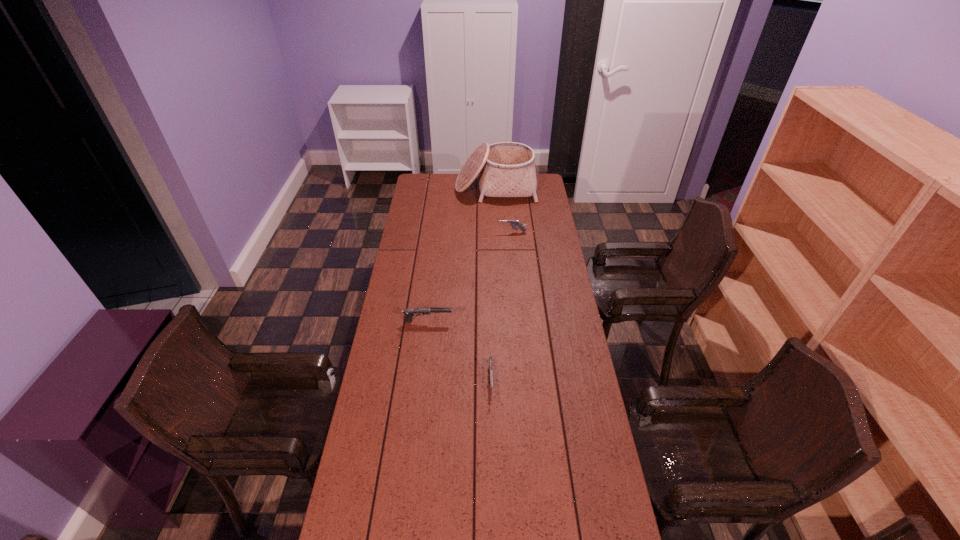
Locate an element on the screen. vacant space at the right edge is located at coordinates (536, 204).

The height and width of the screenshot is (540, 960). Identify the location of vacant space at the far right corner. (539, 181).

You are a GUI agent. You are given a task and a screenshot of the screen. Output one action in this format:
    pyautogui.click(x=<x>, y=<y>)
    Task: Click on the free space between the basket and the second nearest object
    This screenshot has height=540, width=960.
    Given the screenshot: What is the action you would take?
    pyautogui.click(x=462, y=254)

Identify the location of vacant space in between the basket and the farthest gun. This screenshot has width=960, height=540. (504, 210).

Image resolution: width=960 pixels, height=540 pixels. I want to click on free spot between the second gun from right to left and the tallest object, so click(493, 286).

Find the location of a particular element. This screenshot has width=960, height=540. empty space that is in between the tallest object and the farthest gun is located at coordinates (504, 210).

Find the location of a particular element. empty space that is in between the leftmost gun and the tallest object is located at coordinates (462, 254).

Locate an element on the screen. The width and height of the screenshot is (960, 540). free spot between the shortest gun and the leftmost gun is located at coordinates tap(459, 353).

Locate an element on the screen. The width and height of the screenshot is (960, 540). free space between the third nearest object and the basket is located at coordinates (504, 210).

Image resolution: width=960 pixels, height=540 pixels. I want to click on vacant area that lies between the farthest object and the nearest gun, so click(493, 286).